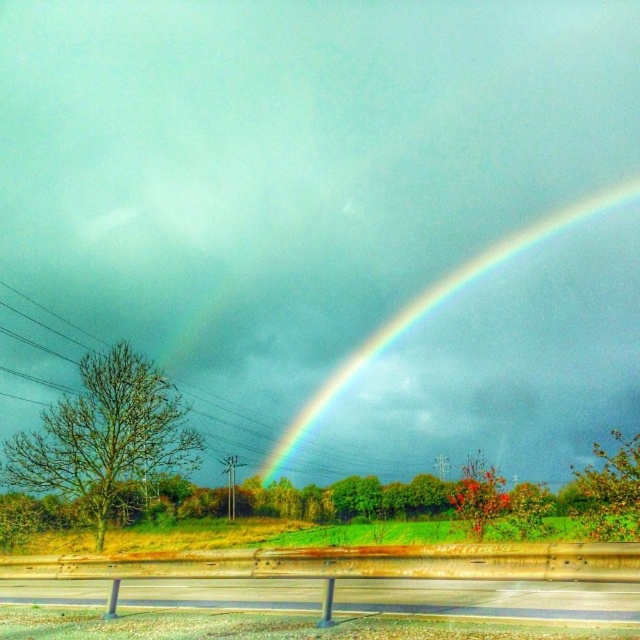
Question: Which point is closer to the camera?

Choices:
 (A) metallic gray highway at lower center
 (B) rainbow at upper center

Answer: (A)

Question: Observing the image, what is the correct spatial positioning of metallic gray highway at lower center in reference to rainbow at upper center?

Choices:
 (A) above
 (B) below

Answer: (B)

Question: Among these objects, which one is nearest to the camera?

Choices:
 (A) rainbow at upper center
 (B) metallic gray highway at lower center

Answer: (B)

Question: Which of the following is the closest to the observer?

Choices:
 (A) rainbow at upper center
 (B) metallic gray highway at lower center

Answer: (B)

Question: Can you confirm if metallic gray highway at lower center is positioned to the right of rainbow at upper center?

Choices:
 (A) yes
 (B) no

Answer: (B)

Question: Is metallic gray highway at lower center to the left of rainbow at upper center from the viewer's perspective?

Choices:
 (A) yes
 (B) no

Answer: (A)